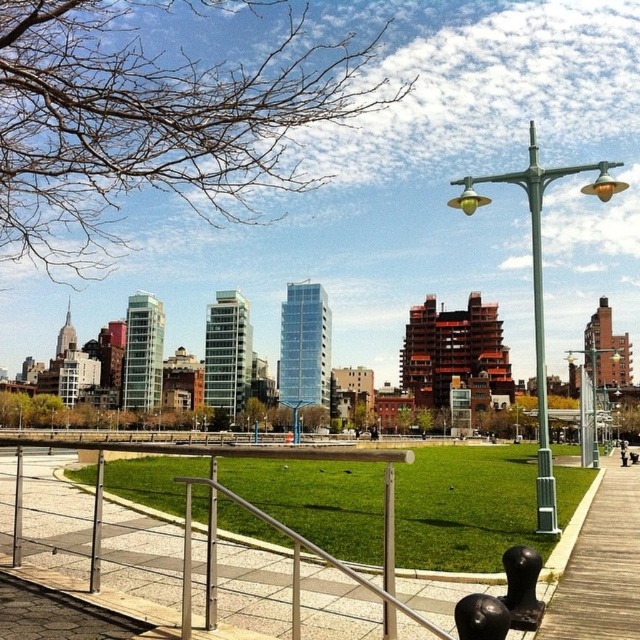
Which is more to the right, green metal lamp post at right or wooden park bench at center?

Positioned to the right is green metal lamp post at right.

Between green metal lamp post at right and wooden park bench at center, which one is positioned higher?

green metal lamp post at right is above.

This screenshot has height=640, width=640. What do you see at coordinates (540, 285) in the screenshot?
I see `green metal lamp post at right` at bounding box center [540, 285].

This screenshot has width=640, height=640. I want to click on green metal lamp post at right, so click(540, 285).

Is point (36, 536) positioned behind point (616, 192)?

No, (36, 536) is in front of (616, 192).

Between silver metallic rail at center and green metal lamp post at right, which one is positioned higher?

green metal lamp post at right is higher up.

Between point (160, 554) and point (458, 182), which one is positioned behind?

Positioned behind is point (458, 182).

The height and width of the screenshot is (640, 640). Find the location of `silver metallic rail at center`. silver metallic rail at center is located at coordinates pyautogui.click(x=90, y=538).

Measure the distance from silver metallic rail at center to wooden park bench at center.

silver metallic rail at center and wooden park bench at center are 195.56 feet apart from each other.

This screenshot has width=640, height=640. Identify the location of silver metallic rail at center. (90, 538).

In order to click on silver metallic rail at center in this screenshot , I will do `click(90, 538)`.